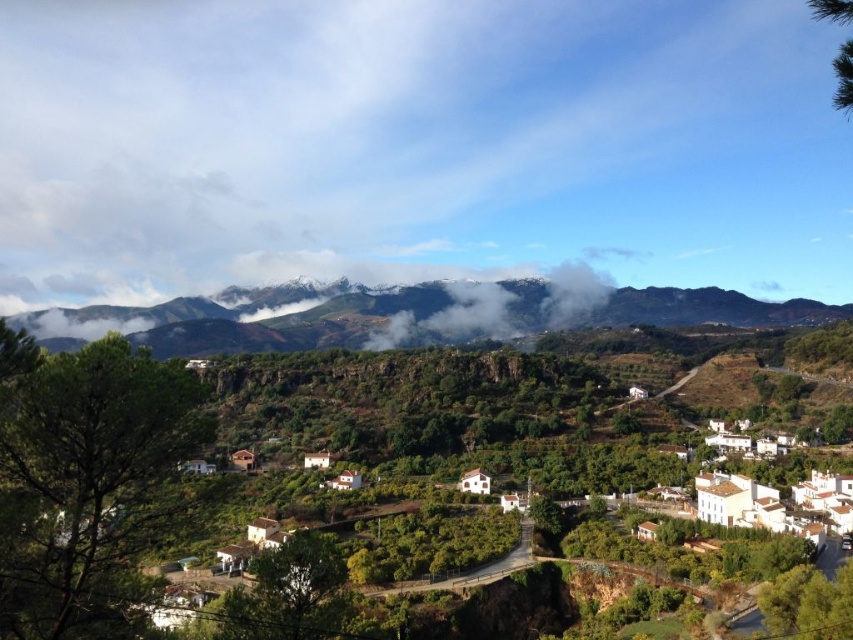
In the scene shown: Does snow-covered mountain at upper center have a greater width compared to white fluffy cloud at center?

Correct, the width of snow-covered mountain at upper center exceeds that of white fluffy cloud at center.

Between point (558, 324) and point (451, 337), which one is positioned behind?

Point (451, 337)

Where is `snow-covered mountain at upper center`? The width and height of the screenshot is (853, 640). snow-covered mountain at upper center is located at coordinates (264, 317).